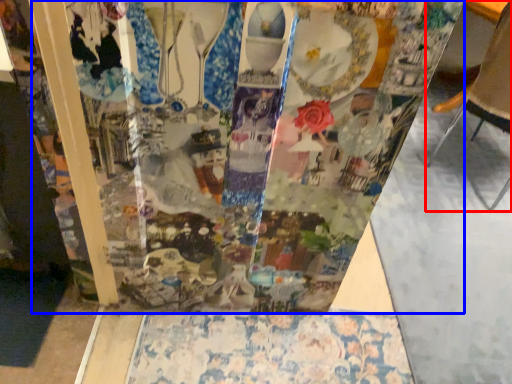
Question: Which of the following is the closest to the observer, furniture (highlighted by a red box) or glass box (highlighted by a blue box)?

Choices:
 (A) furniture
 (B) glass box

Answer: (B)